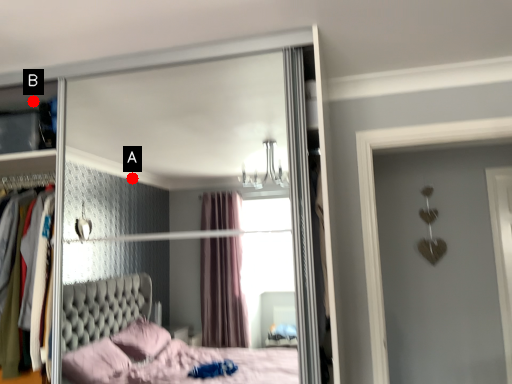
Question: Two points are circled on the image, labeled by A and B beside each circle. Which point appears closest to the camera in this image?

Choices:
 (A) A is closer
 (B) B is closer

Answer: (B)